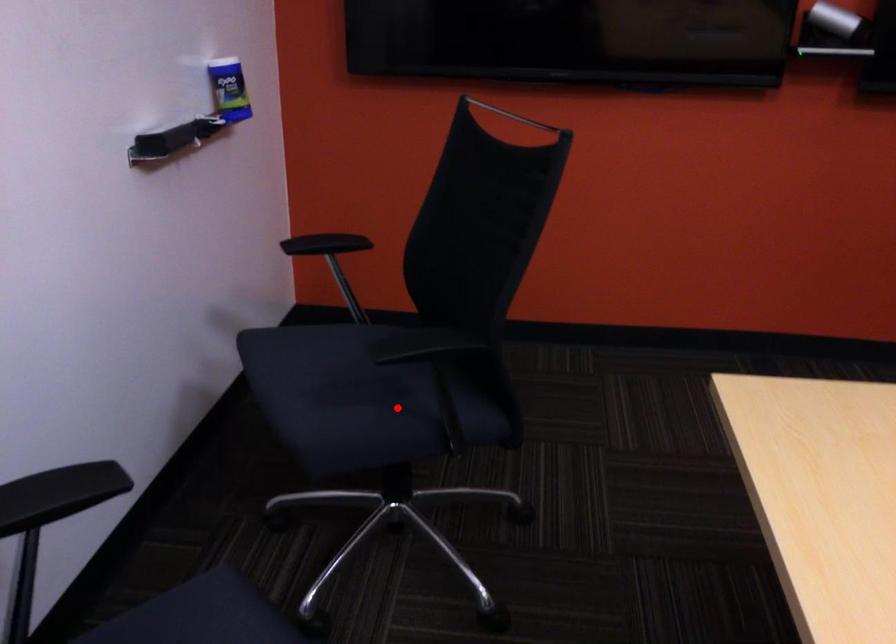
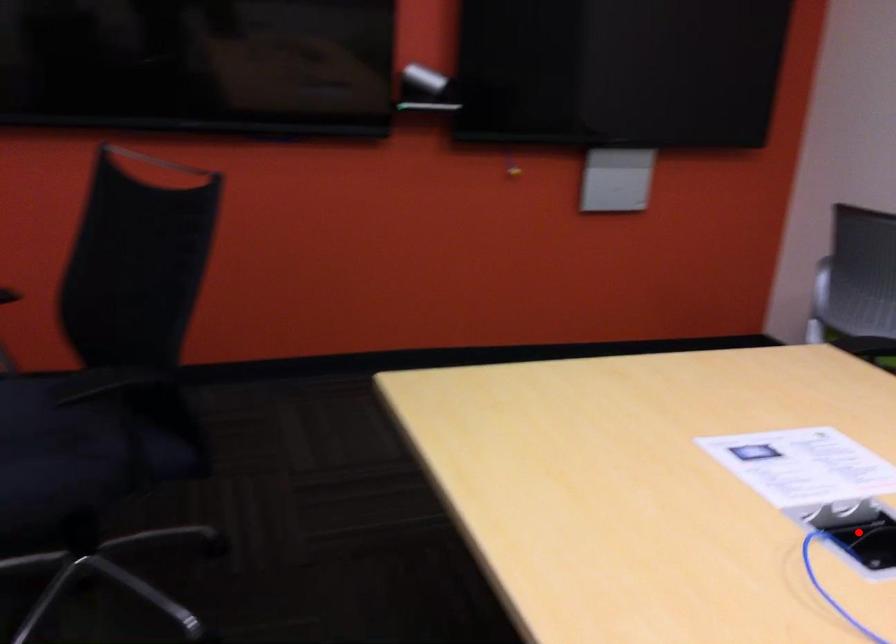
I am providing you with two images of the same scene from different viewpoints. A red point is marked on the first image and another point is marked on the second image. Is the marked point in image1 the same physical position as the marked point in image2?

No